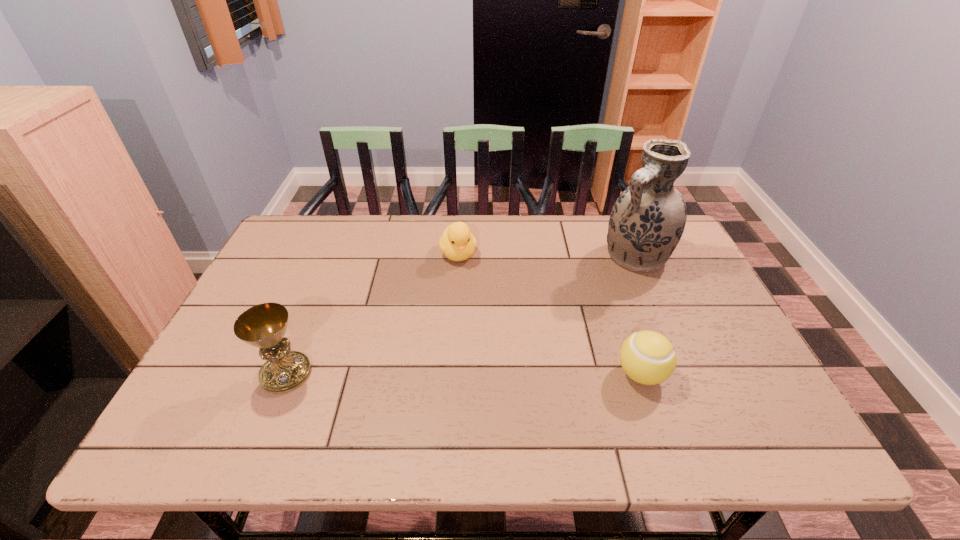
This screenshot has height=540, width=960. What are the coordinates of `vacant spot on the desktop that is between the third shortest object and the tennis ball and is positioned on the front-facing side of the second object from left to right` in the screenshot? It's located at (509, 374).

Identify the location of free space on the desktop that is between the leftmost object and the tennis ball and is positioned with the handle on the side of the tallest object. The height and width of the screenshot is (540, 960). (492, 374).